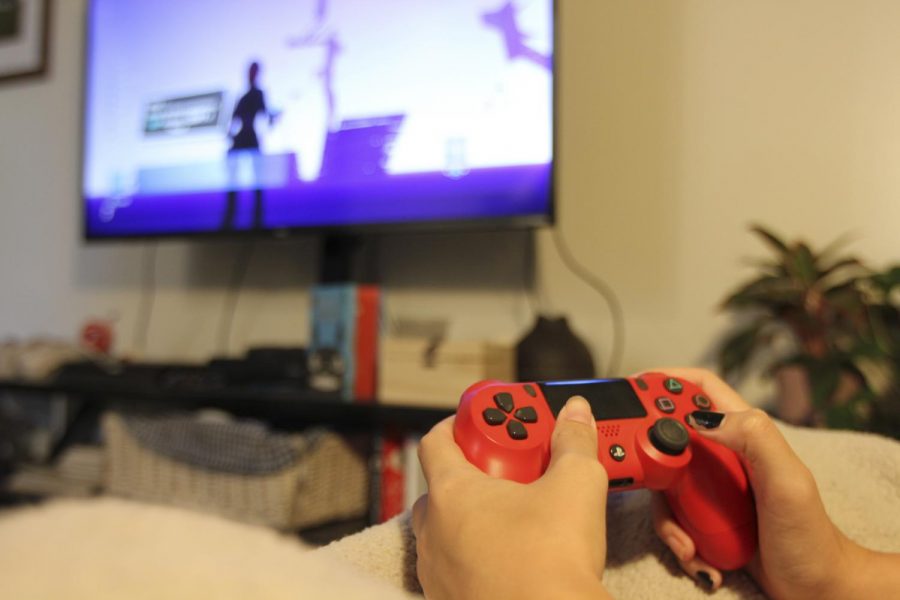
Locate an element on the screen. The width and height of the screenshot is (900, 600). cord is located at coordinates pyautogui.click(x=588, y=280).